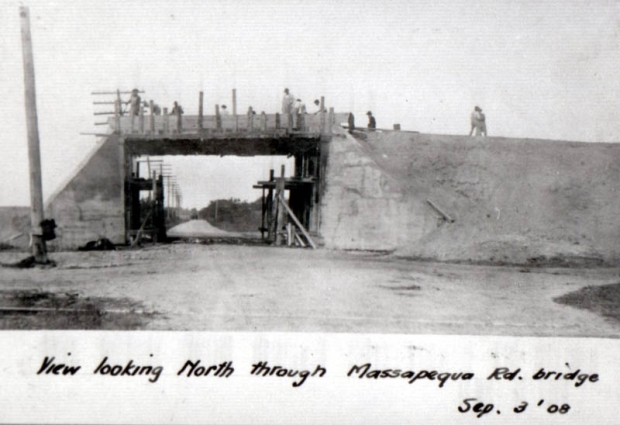
Find the location of a particular element. The image size is (620, 425). pots is located at coordinates (82, 323).